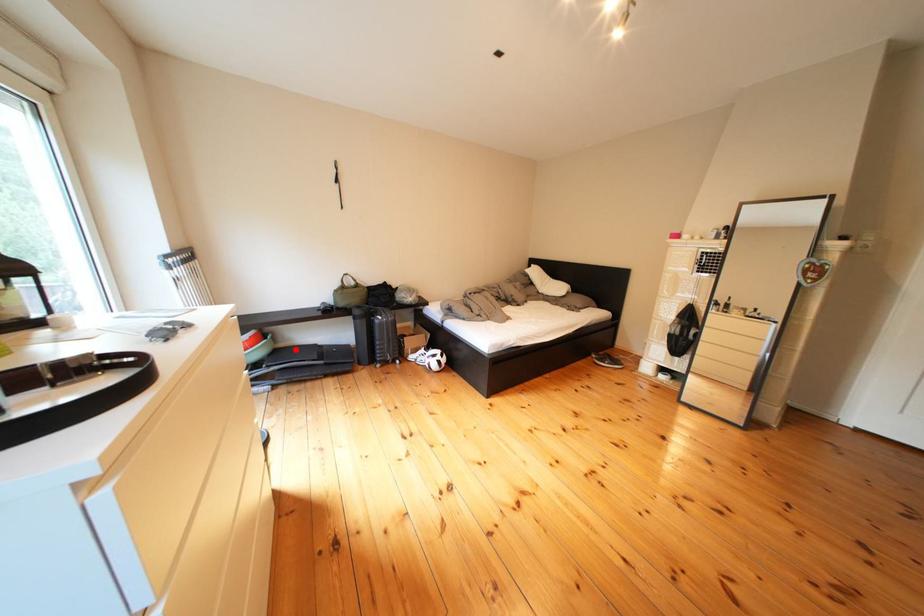
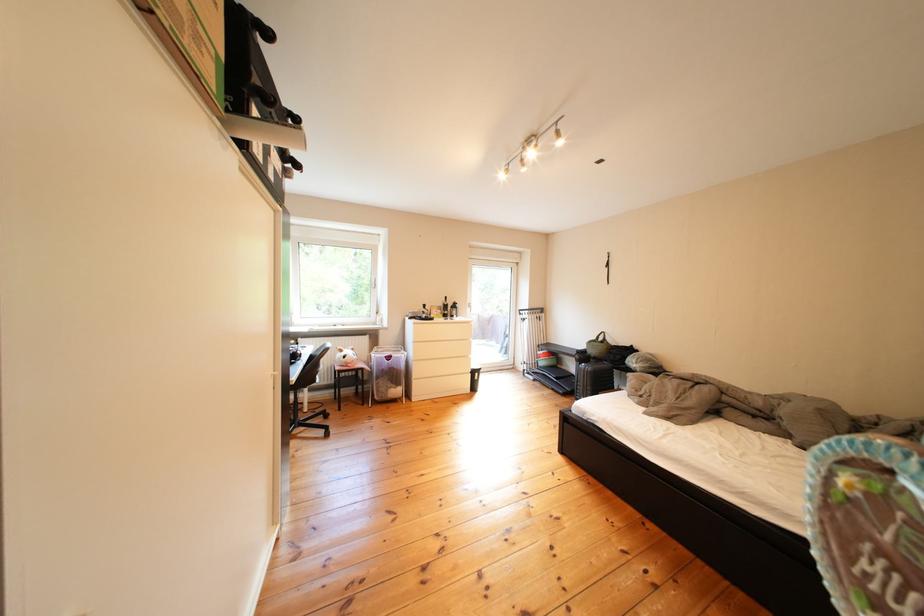
In the second image, find the point that corresponds to the highlighted location in the first image.

(578, 371)